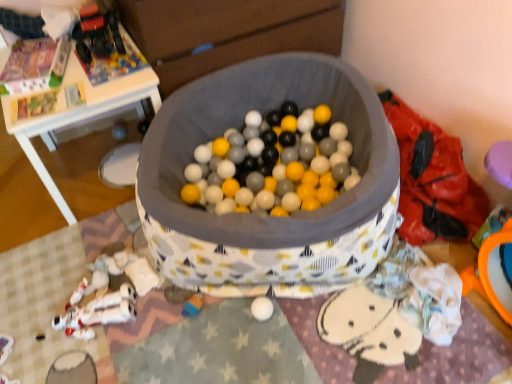
Where is `free location in front of rubberized plastic toy at lower center, the fourth toy viewed from the top`? free location in front of rubberized plastic toy at lower center, the fourth toy viewed from the top is located at coordinates (193, 350).